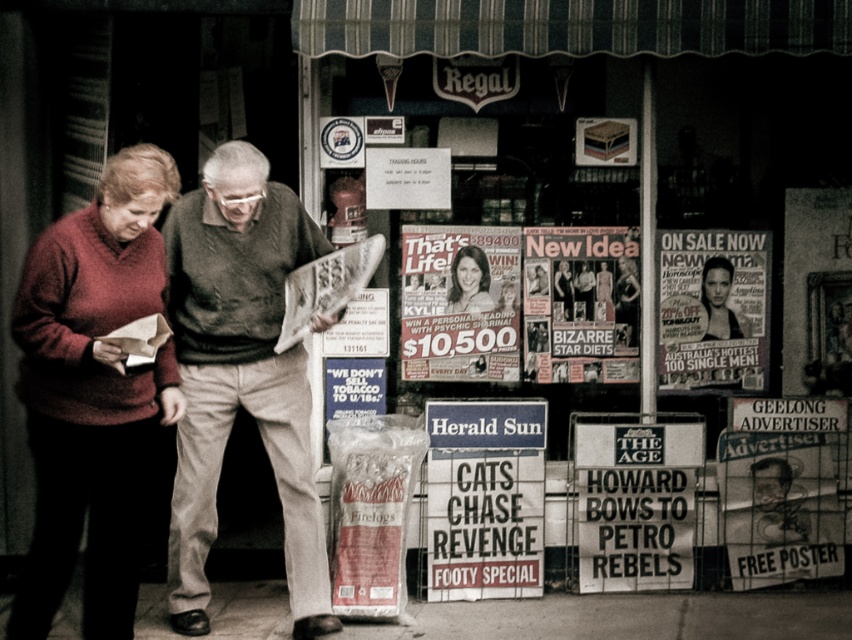
Question: Which point appears farthest from the camera in this image?

Choices:
 (A) (722, 291)
 (B) (681, 369)

Answer: (A)

Question: Can you confirm if black glossy poster at center is positioned above smooth black hair at center?

Choices:
 (A) no
 (B) yes

Answer: (A)

Question: Which point appears closest to the camera in this image?

Choices:
 (A) (191, 209)
 (B) (712, 324)

Answer: (A)

Question: Can you confirm if dark green sweater at center is bigger than smooth black hair at center?

Choices:
 (A) yes
 (B) no

Answer: (A)

Question: Which of the following is the closest to the observer?

Choices:
 (A) smooth black hair at center
 (B) dark green sweater at center
 (C) matte paper poster at center
 (D) black glossy poster at center

Answer: (B)

Question: Where is matte paper poster at center located in relation to black glossy poster at center in the image?

Choices:
 (A) left
 (B) right

Answer: (A)